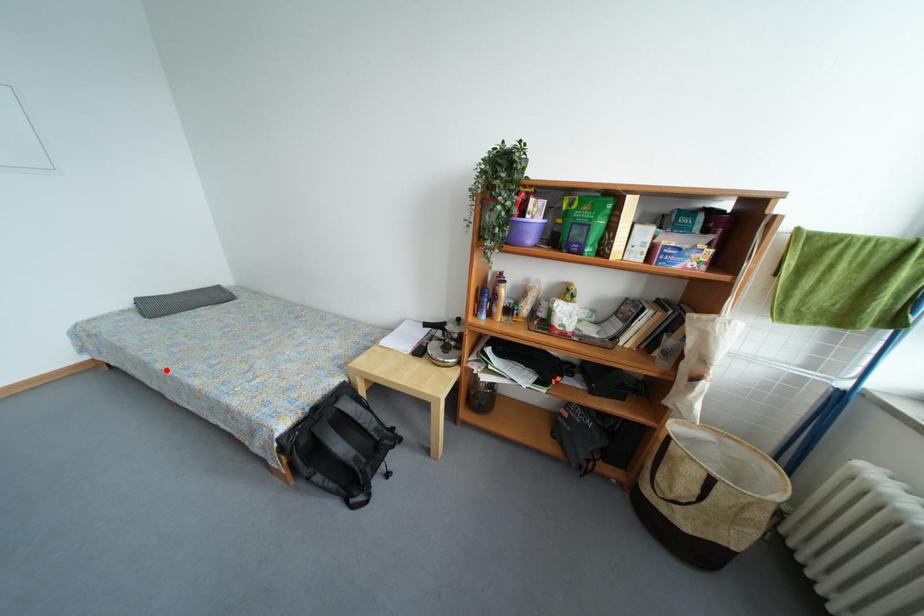
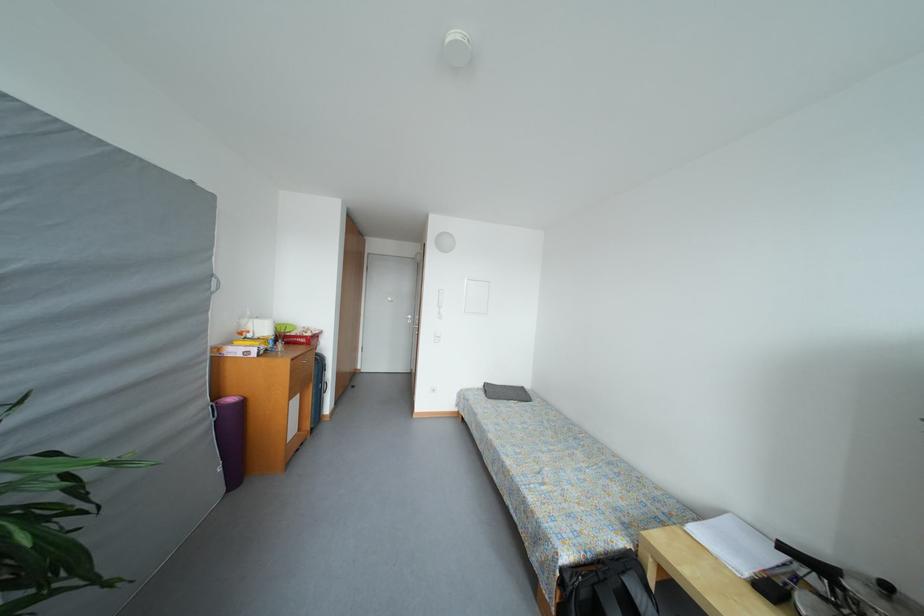
Find the pixel in the second image that matches the highlighted location in the first image.

(496, 440)